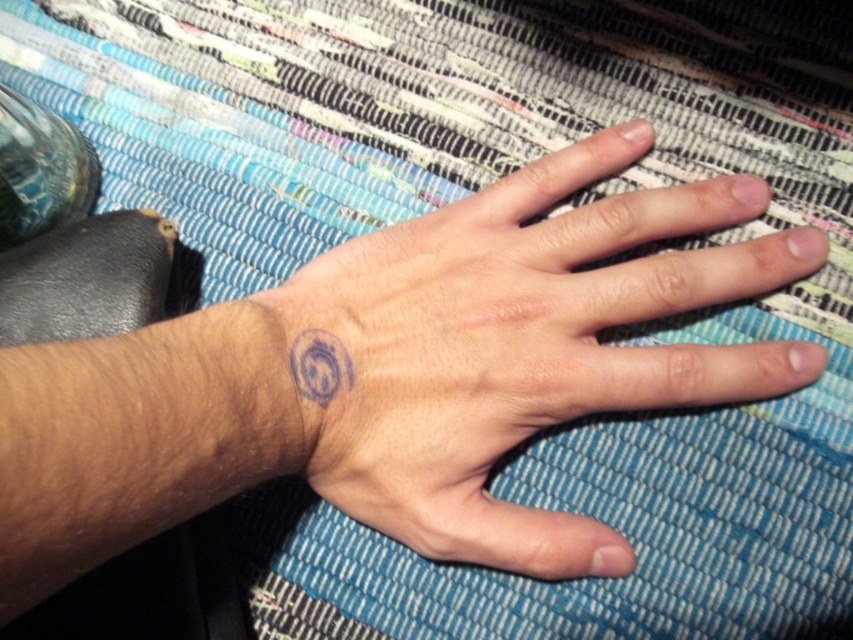
You are an artist trying to sketch the tattoos based on the image. Which tattoo, the purple ink tattoo at center or the blue ink tattoo at wrist, should you focus on first to capture the depth in your drawing?

The purple ink tattoo at center should be focused on first because it is closer to the viewer than the blue ink tattoo at wrist, allowing you to establish the foreground elements before moving to the background.

You are an artist trying to replicate the tattoos on the hand. Which tattoo, the purple ink tattoo at center or the blue ink tattoo at wrist, is layered on top of the other?

The purple ink tattoo at center is positioned over the blue ink tattoo at wrist, meaning the purple one is layered on top.